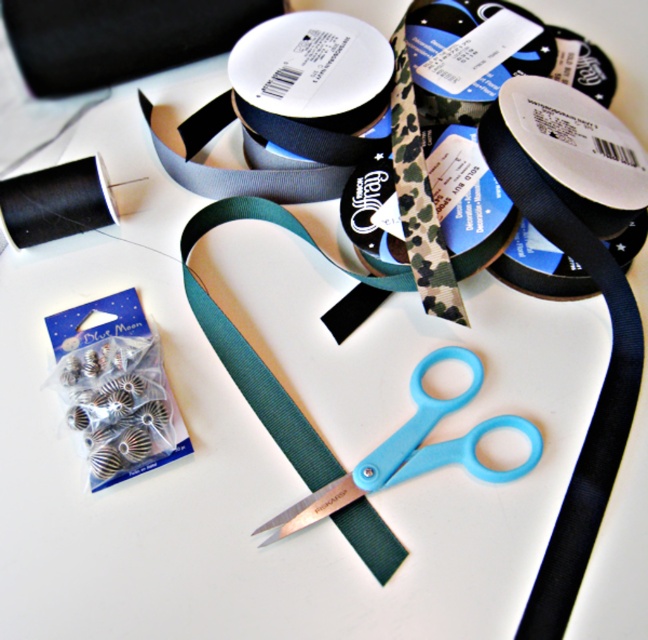
Does black matte ribbon at upper right lie in front of camo fabric tape at upper center?

That is True.

What do you see at coordinates (581, 157) in the screenshot? I see `black matte ribbon at upper right` at bounding box center [581, 157].

You are a GUI agent. You are given a task and a screenshot of the screen. Output one action in this format:
    pyautogui.click(x=<x>, y=<y>)
    Task: Click on the black matte ribbon at upper right
    The image size is (648, 640).
    Given the screenshot: What is the action you would take?
    pyautogui.click(x=581, y=157)

You are a GUI agent. You are given a task and a screenshot of the screen. Output one action in this format:
    pyautogui.click(x=<x>, y=<y>)
    Task: Click on the black matte ribbon at upper right
    Image resolution: width=648 pixels, height=640 pixels.
    Given the screenshot: What is the action you would take?
    pyautogui.click(x=581, y=157)

Is the position of matte black ribbon at upper center less distant than that of blue plastic scissors at center?

No, it is not.

Consider the image. Is matte black ribbon at upper center positioned behind blue plastic scissors at center?

Yes, matte black ribbon at upper center is behind blue plastic scissors at center.

Is point (262, 104) positioned after point (470, 449)?

That is True.

This screenshot has width=648, height=640. I want to click on matte black ribbon at upper center, so click(314, 84).

What do you see at coordinates (500, 61) in the screenshot?
I see `camo fabric tape at upper center` at bounding box center [500, 61].

Based on the photo, between camo fabric tape at upper center and black matte thread at upper left, which one is positioned lower?

black matte thread at upper left is lower down.

Which is in front, point (526, 19) or point (12, 224)?

Point (12, 224)

The height and width of the screenshot is (640, 648). What are the coordinates of `camo fabric tape at upper center` in the screenshot? It's located at (500, 61).